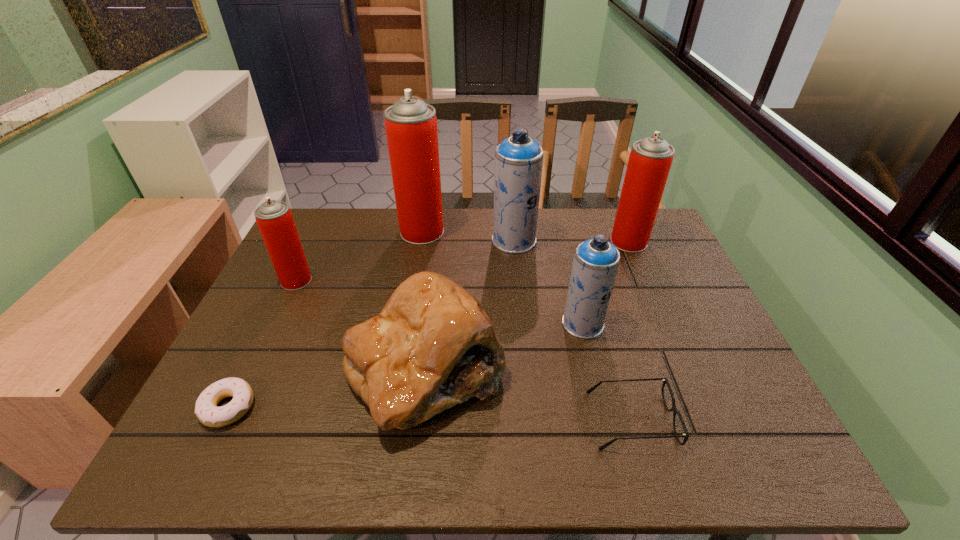
The width and height of the screenshot is (960, 540). Find the location of `vacant region between the fourth farthest object and the bigger blue aerosol can`. vacant region between the fourth farthest object and the bigger blue aerosol can is located at coordinates (405, 260).

Find the location of a particular element. empty location between the right blue aerosol can and the brownish-beige bread is located at coordinates (504, 346).

Locate an element on the screen. This screenshot has width=960, height=540. object that can be found as the fifth closest to the bigger blue aerosol can is located at coordinates (665, 381).

Select which object is the third closest to the right blue aerosol can. Please provide its 2D coordinates. Your answer should be formatted as a tuple, i.e. [(x, y)], where the tuple contains the x and y coordinates of a point satisfying the conditions above.

[(518, 166)]

Choose which aerosol can is the nearest neighbor to the nearest aerosol can. Please provide its 2D coordinates. Your answer should be formatted as a tuple, i.e. [(x, y)], where the tuple contains the x and y coordinates of a point satisfying the conditions above.

[(518, 166)]

Where is `aerosol can that is the third closest one to the fourth farthest object`? aerosol can that is the third closest one to the fourth farthest object is located at coordinates (595, 264).

Image resolution: width=960 pixels, height=540 pixels. What are the coordinates of `red aerosol can that is the second closest one to the farther blue aerosol can` in the screenshot? It's located at click(x=650, y=160).

Point out which red aerosol can is positioned as the nearest to the doughnut. Please provide its 2D coordinates. Your answer should be formatted as a tuple, i.e. [(x, y)], where the tuple contains the x and y coordinates of a point satisfying the conditions above.

[(274, 218)]

I want to click on free point that satisfies the following two spatial constraints: 1. on the back side of the rightmost aerosol can; 2. on the right side of the nearest aerosol can, so click(564, 242).

Image resolution: width=960 pixels, height=540 pixels. What are the coordinates of `vacant position in the image that satisfies the following two spatial constraints: 1. on the back side of the second aerosol can from right to left; 2. on the right side of the rightmost aerosol can` in the screenshot? It's located at (564, 242).